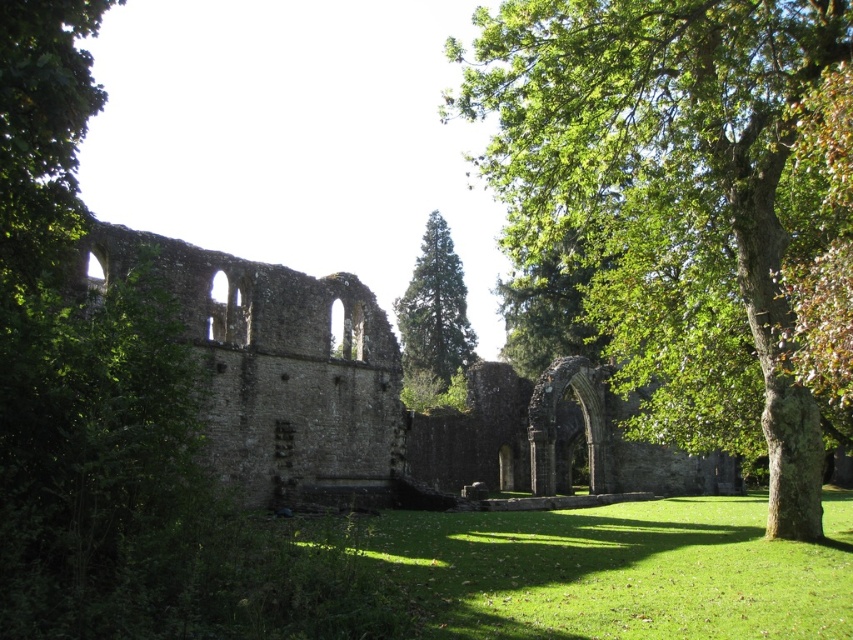
You are standing at the point labeled point (691,202) in the image. What do you see directly in front of you?

You see a green leafy tree at center directly in front of you.

Looking at this image, you are a hiker standing in the ruins of an old stone building and notice two trees at the center. Which one is taller between the green leafy tree at center and the green coniferous tree at center?

The green leafy tree at center is taller than the green coniferous tree at center.

You are an archaeologist examining the ruins. You need to determine if the stone archway at center can be seen from the green grass at lower center without any obstruction. Can you confirm this?

The stone archway at center is much taller than the green grass at lower center, so yes, the stone archway at center can be seen from the green grass at lower center without any obstruction.